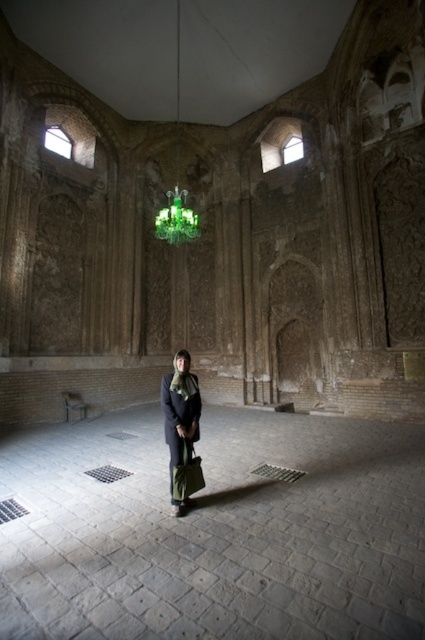
Question: Does green glass chandelier at upper center appear under green fabric bag at center?

Choices:
 (A) yes
 (B) no

Answer: (B)

Question: Which point is farther to the camera?

Choices:
 (A) green glass chandelier at upper center
 (B) green fabric bag at center

Answer: (A)

Question: Is green glass chandelier at upper center to the left of green fabric bag at center from the viewer's perspective?

Choices:
 (A) no
 (B) yes

Answer: (B)

Question: Does dark gray fabric scarf at center appear on the right side of green fabric bag at center?

Choices:
 (A) yes
 (B) no

Answer: (A)

Question: Among these objects, which one is farthest from the camera?

Choices:
 (A) green glass chandelier at upper center
 (B) green fabric bag at center
 (C) dark gray fabric scarf at center

Answer: (A)

Question: Considering the real-world distances, which object is farthest from the dark gray fabric scarf at center?

Choices:
 (A) green fabric bag at center
 (B) green glass chandelier at upper center

Answer: (B)